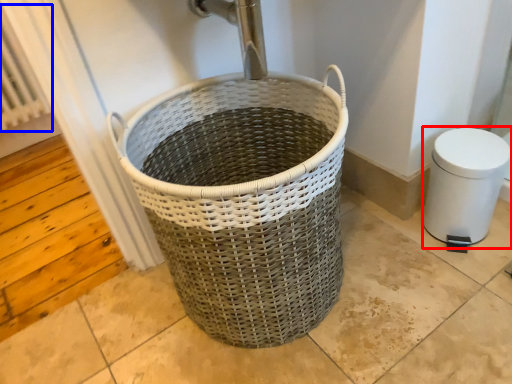
Question: Among these objects, which one is nearest to the camera, bidet (highlighted by a red box) or radiator (highlighted by a blue box)?

Choices:
 (A) bidet
 (B) radiator

Answer: (A)